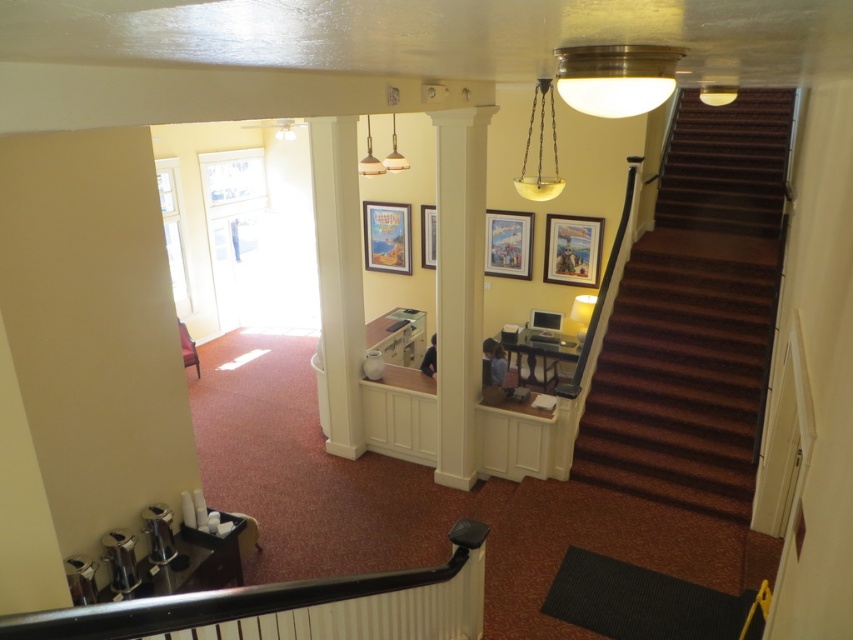
Looking at this image, you are a delivery person carrying a large package and need to navigate from the lower floor to the upper floor. The brown carpeted stairs at right and the black plastic handrail at lower center are in your path. Given that the distance between them is 3.64 meters, can you safely maneuver around both while carrying your package?

The brown carpeted stairs at right is 3.64 meters away from the black plastic handrail at lower center. Since the distance is sufficient, you can safely maneuver around both the brown carpeted stairs at right and the black plastic handrail at lower center while carrying the package.

You are standing at the top of the staircase and want to hang two wooden picture frames on the wall. The first is the wooden picture frame at upper center and the second is the wooden picture frame at center. Based on their current positions, which frame should you place higher up on the wall?

The wooden picture frame at upper center is currently below the wooden picture frame at center, so to maintain their relative positions, you should place the wooden picture frame at center higher up on the wall than the wooden picture frame at upper center.

From the picture: You are a maintenance worker checking the brown carpeted stairs at right and the black plastic handrail at lower center. Which object is smaller in size?

The brown carpeted stairs at right is smaller than the black plastic handrail at lower center according to the description.